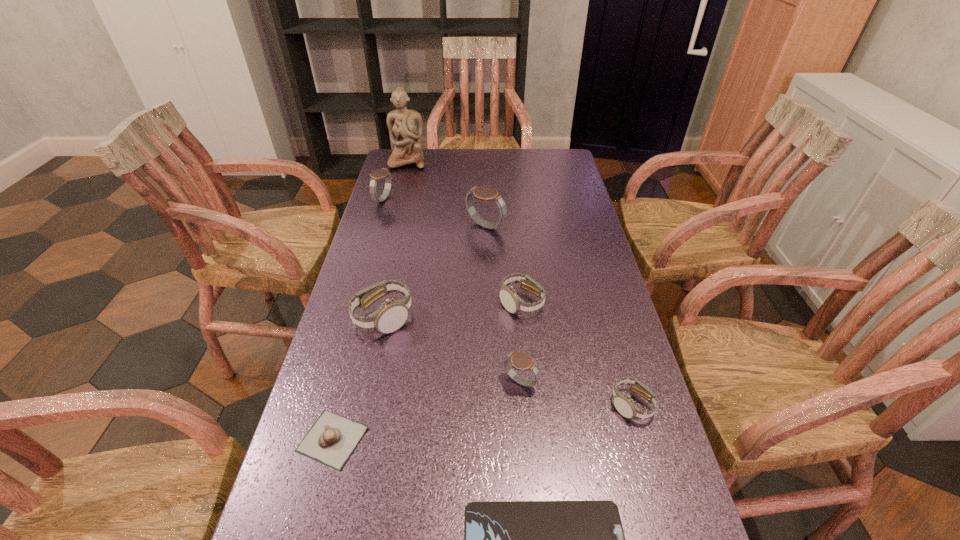
The height and width of the screenshot is (540, 960). I want to click on the rightmost object, so click(413, 539).

The width and height of the screenshot is (960, 540). In order to click on garlic in this screenshot , I will do `click(413, 539)`.

The width and height of the screenshot is (960, 540). Find the location of `vacant space situated on the front-facing side of the farthest object`. vacant space situated on the front-facing side of the farthest object is located at coordinates (402, 183).

Identify the location of vacant space located on the left of the second farthest watch. (417, 227).

Locate an element on the screen. The width and height of the screenshot is (960, 540). free space located on the back of the second farthest object is located at coordinates (396, 159).

Identify the location of free spot located on the face of the biggest white watch. (520, 318).

Find the location of a particular element. The image size is (960, 540). vacant space located on the face of the second smallest white watch is located at coordinates (535, 444).

Identify the location of free spot located 0.290m on the left of the nearest gray watch. The width and height of the screenshot is (960, 540). tap(373, 382).

Identify the location of vacant space located 0.080m on the face of the third shortest object. (647, 461).

Identify the location of vacant region located 0.110m on the front of the garlic. Image resolution: width=960 pixels, height=540 pixels. (307, 535).